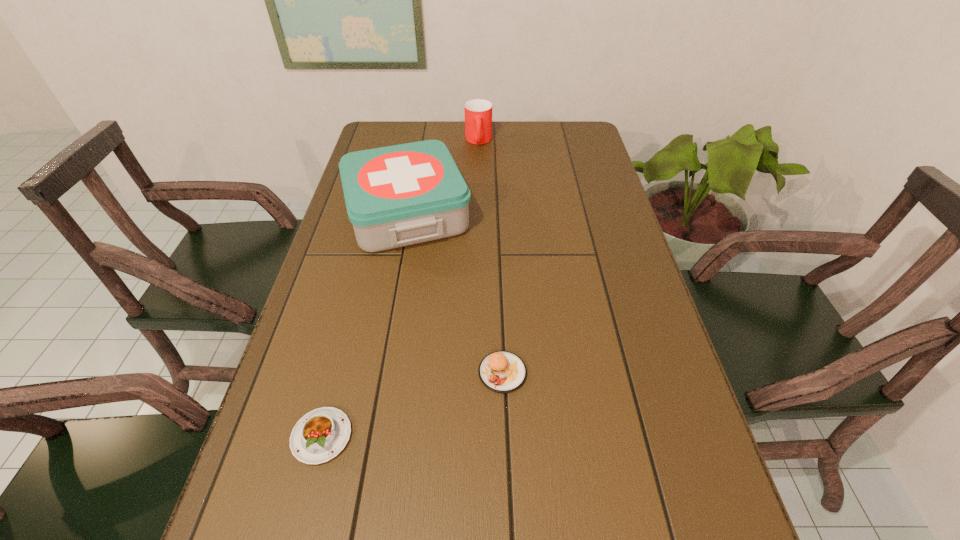
Locate an element on the screen. The width and height of the screenshot is (960, 540). blank region between the farthest object and the shortest object is located at coordinates (400, 289).

I want to click on unoccupied area between the patty and the cup, so click(491, 256).

Locate an element on the screen. The width and height of the screenshot is (960, 540). vacant area that lies between the pudding and the farthest object is located at coordinates (400, 289).

Find the location of `empty space that is in between the nearest object and the first-aid kit`. empty space that is in between the nearest object and the first-aid kit is located at coordinates (365, 325).

Where is `free spot between the farthest object and the shortest object`? This screenshot has width=960, height=540. free spot between the farthest object and the shortest object is located at coordinates (400, 289).

You are a GUI agent. You are given a task and a screenshot of the screen. Output one action in this format:
    pyautogui.click(x=<x>, y=<y>)
    Task: Click on the empty space between the patty and the first-aid kit
    Image resolution: width=960 pixels, height=540 pixels.
    Given the screenshot: What is the action you would take?
    pyautogui.click(x=455, y=293)

Where is `empty location between the third nearest object and the shortest object`? empty location between the third nearest object and the shortest object is located at coordinates (365, 325).

Image resolution: width=960 pixels, height=540 pixels. In order to click on vacant area between the third farthest object and the cup in this screenshot , I will do `click(491, 256)`.

Image resolution: width=960 pixels, height=540 pixels. I want to click on object that is the third nearest to the first-aid kit, so click(x=320, y=435).

Find the location of a particular element. object that is the second nearest to the pudding is located at coordinates (400, 195).